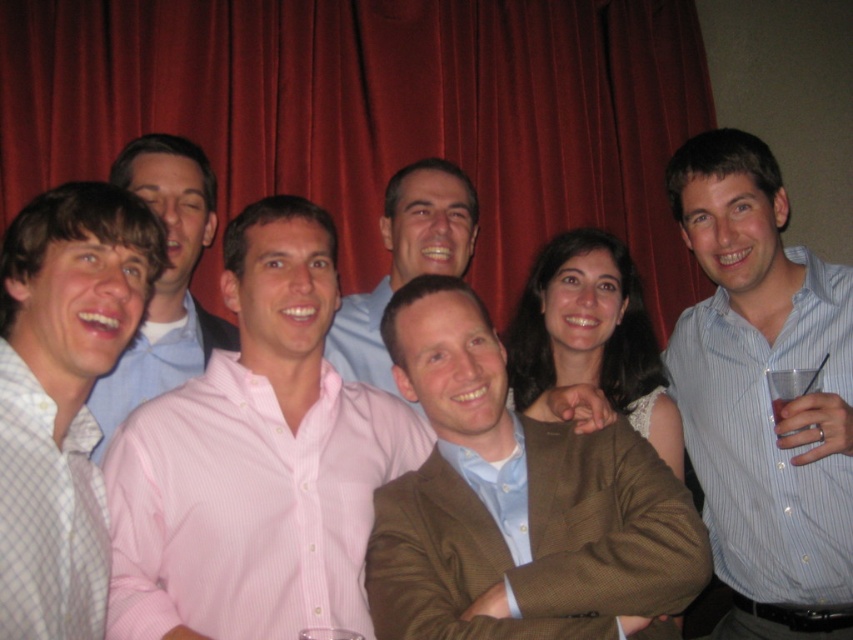
Question: Observing the image, what is the correct spatial positioning of pink striped shirt at center in reference to pink striped shirt at left?

Choices:
 (A) left
 (B) right

Answer: (B)

Question: Can you confirm if light blue checkered shirt at left is wider than matte blue shirt at center?

Choices:
 (A) yes
 (B) no

Answer: (B)

Question: Which object is closer to the camera taking this photo?

Choices:
 (A) pink striped shirt at left
 (B) matte blue shirt at center

Answer: (A)

Question: Which point is farther from the camera taking this photo?

Choices:
 (A) tap(817, 442)
 (B) tap(78, 422)
 (C) tap(142, 328)

Answer: (C)

Question: From the image, what is the correct spatial relationship of brown textured blazer at center in relation to pink striped shirt at left?

Choices:
 (A) above
 (B) below

Answer: (B)

Question: Which of the following is the closest to the observer?

Choices:
 (A) light blue checkered shirt at left
 (B) matte blue shirt at center
 (C) brown textured blazer at center
 (D) blue striped shirt at center

Answer: (A)